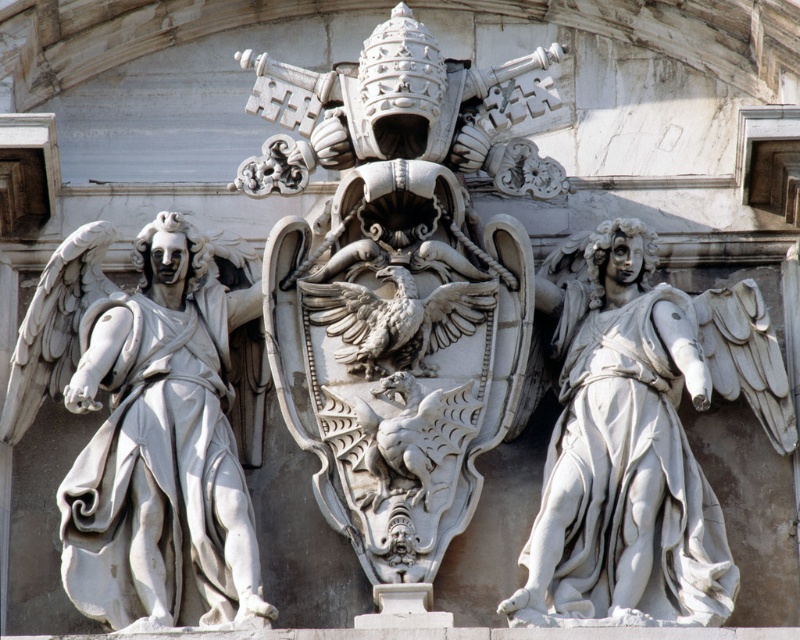
Question: Does white marble coat of arms at center come in front of white marble angel at right?

Choices:
 (A) no
 (B) yes

Answer: (A)

Question: Which point appears farthest from the camera in this image?

Choices:
 (A) (546, 509)
 (B) (190, 259)
 (C) (344, 310)

Answer: (B)

Question: Which object appears farthest from the camera in this image?

Choices:
 (A) white marble angel at left
 (B) white marble coat of arms at center

Answer: (B)

Question: Does white marble coat of arms at center appear under white marble angel at left?

Choices:
 (A) yes
 (B) no

Answer: (B)

Question: Which object is closer to the camera taking this photo?

Choices:
 (A) white marble coat of arms at center
 (B) white marble angel at right
 (C) white marble angel at left

Answer: (B)

Question: Is white marble coat of arms at center below white marble angel at left?

Choices:
 (A) yes
 (B) no

Answer: (B)